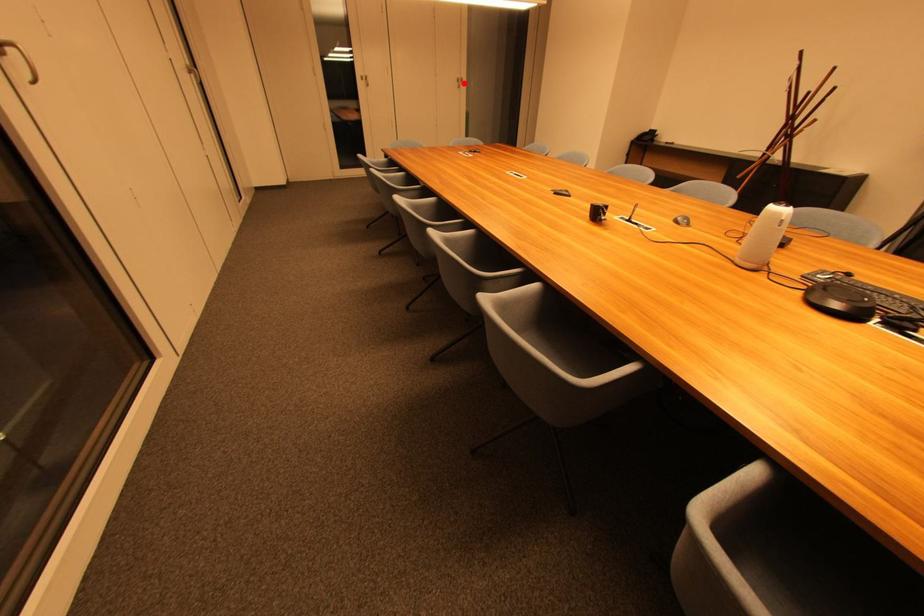
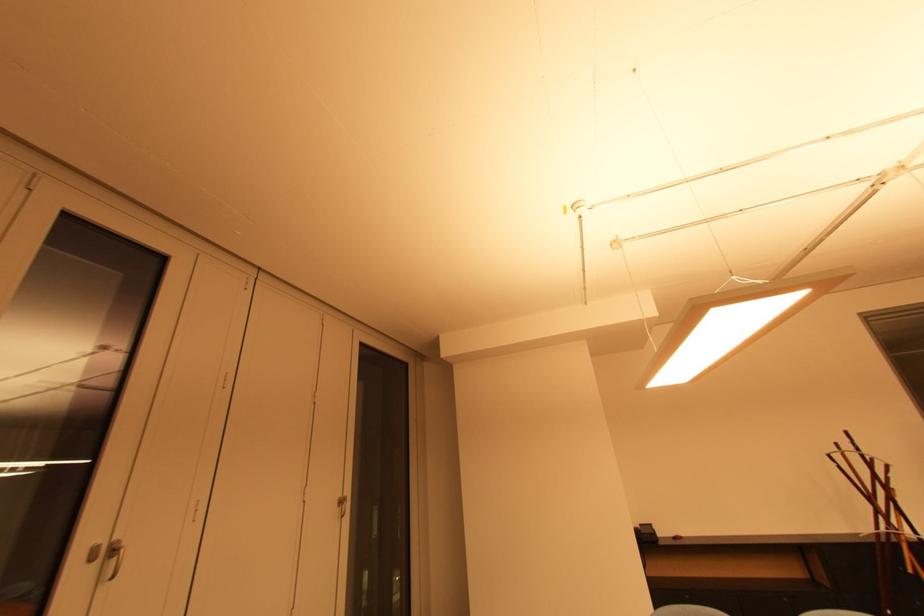
Where in the second image is the point corresponding to the highlighted location from the first image?

(346, 504)